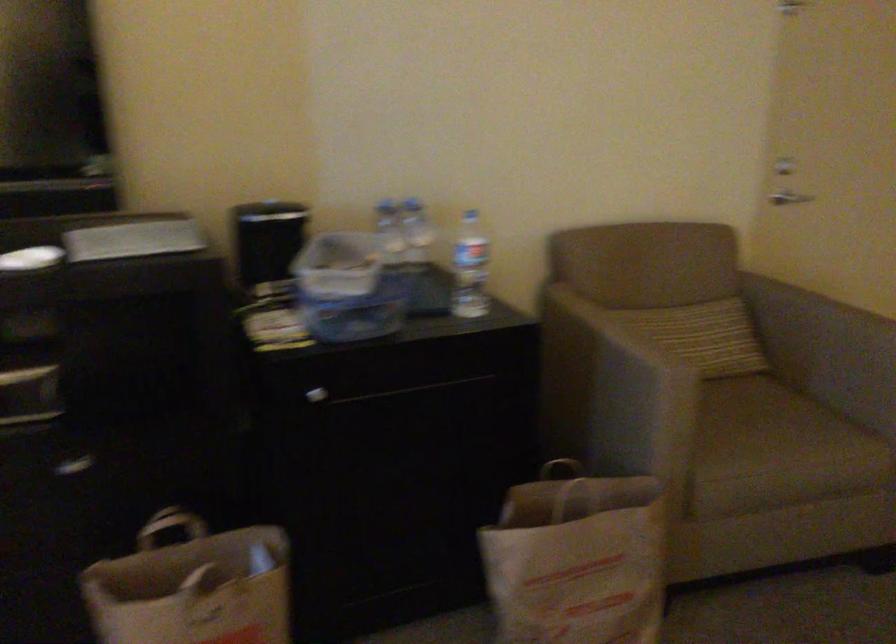
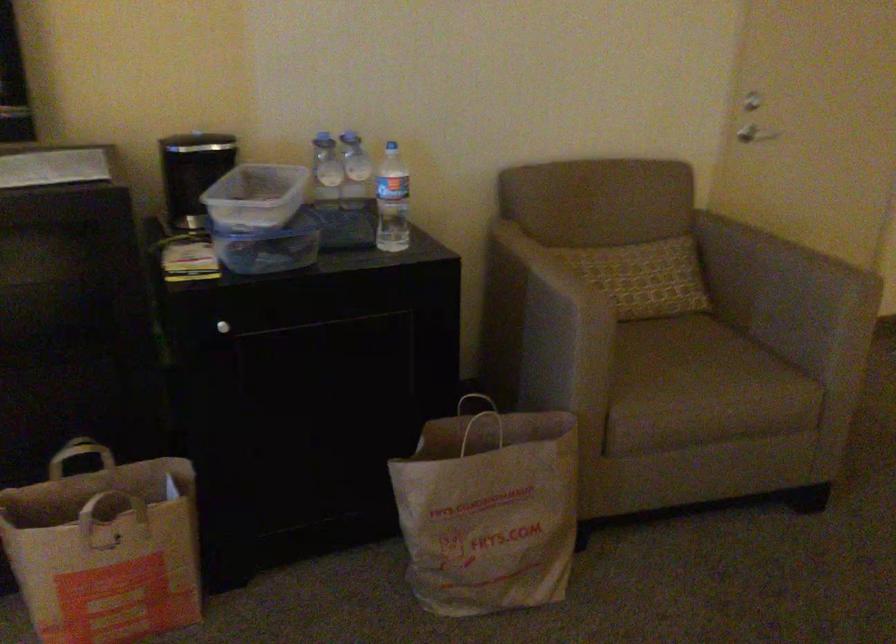
Where in the second image is the point corresponding to point 804,194 from the first image?

(760, 135)